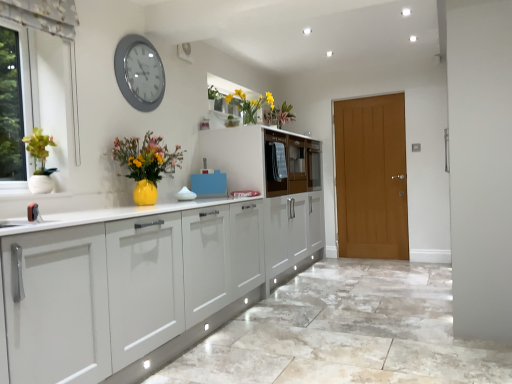
Question: Can you confirm if wooden cabinet at center is positioned to the right of matte yellow vase at center?

Choices:
 (A) yes
 (B) no

Answer: (A)

Question: Is wooden cabinet at center next to matte yellow vase at center?

Choices:
 (A) yes
 (B) no

Answer: (B)

Question: From the image's perspective, would you say wooden cabinet at center is positioned over matte yellow vase at center?

Choices:
 (A) no
 (B) yes

Answer: (B)

Question: Is wooden cabinet at center completely or partially outside of matte yellow vase at center?

Choices:
 (A) yes
 (B) no

Answer: (A)

Question: Is wooden cabinet at center facing towards matte yellow vase at center?

Choices:
 (A) yes
 (B) no

Answer: (B)

Question: Is silver metallic clock at upper left bigger or smaller than matte wood door at right?

Choices:
 (A) big
 (B) small

Answer: (B)

Question: In terms of height, does silver metallic clock at upper left look taller or shorter compared to matte wood door at right?

Choices:
 (A) short
 (B) tall

Answer: (A)

Question: Based on their positions, is silver metallic clock at upper left located to the left or right of matte wood door at right?

Choices:
 (A) left
 (B) right

Answer: (A)

Question: In the image, is silver metallic clock at upper left positioned in front of or behind matte wood door at right?

Choices:
 (A) front
 (B) behind

Answer: (A)

Question: Considering the positions of matte white drawer at center and matte yellow vase at center in the image, is matte white drawer at center taller or shorter than matte yellow vase at center?

Choices:
 (A) short
 (B) tall

Answer: (B)

Question: Looking at their shapes, would you say matte white drawer at center is wider or thinner than matte yellow vase at center?

Choices:
 (A) wide
 (B) thin

Answer: (A)

Question: From a real-world perspective, is matte white drawer at center positioned above or below matte yellow vase at center?

Choices:
 (A) below
 (B) above

Answer: (B)

Question: From the image's perspective, is matte white drawer at center positioned above or below matte yellow vase at center?

Choices:
 (A) below
 (B) above

Answer: (B)

Question: From the image's perspective, relative to yellow matte vase at upper center, is matte yellow vase at center above or below?

Choices:
 (A) above
 (B) below

Answer: (B)

Question: Considering the positions of matte yellow vase at center and yellow matte vase at upper center in the image, is matte yellow vase at center taller or shorter than yellow matte vase at upper center?

Choices:
 (A) short
 (B) tall

Answer: (B)